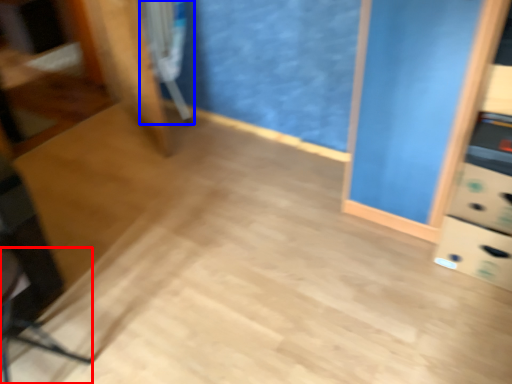
Question: Which point is closer to the camera, swivel chair (highlighted by a red box) or swivel chair (highlighted by a blue box)?

Choices:
 (A) swivel chair
 (B) swivel chair

Answer: (A)